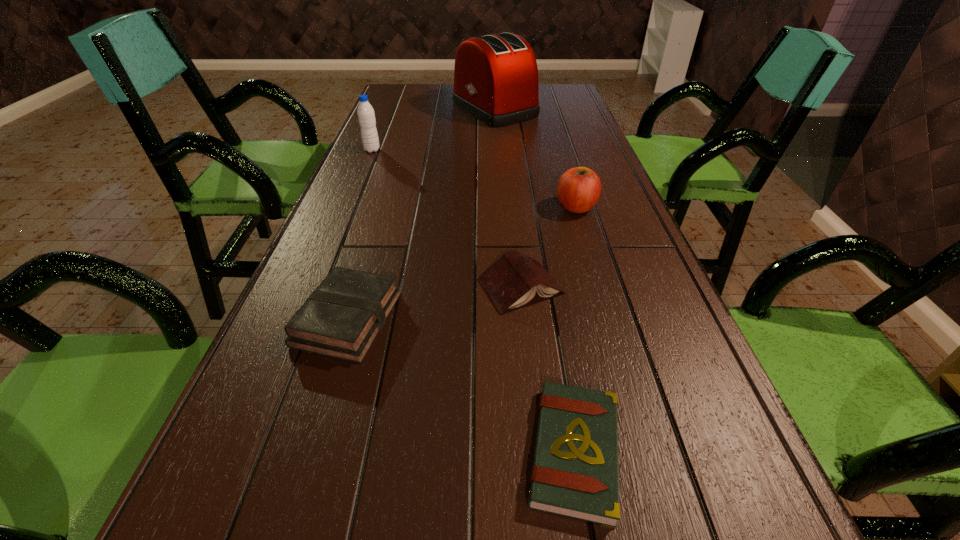
Locate an element on the screen. The height and width of the screenshot is (540, 960). book object that ranks as the second closest to the fourth shortest object is located at coordinates (341, 319).